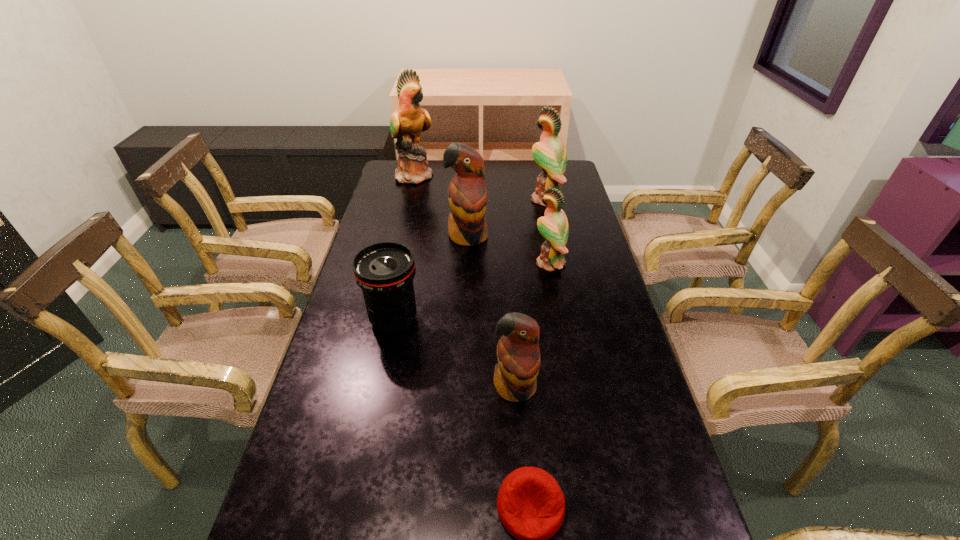
Locate an element on the screen. vacant space in between the second shortest object and the second biggest green parrot is located at coordinates (470, 260).

At what (x,y) coordinates should I click in order to perform the action: click on object that is the sixth closest one to the black telephoto lens. Please return your answer as a coordinate pair (x, y). Looking at the image, I should click on (409, 120).

Select which object appears as the fourth closest to the second farthest object. Please provide its 2D coordinates. Your answer should be formatted as a tuple, i.e. [(x, y)], where the tuple contains the x and y coordinates of a point satisfying the conditions above.

[(384, 271)]

Identify which parrot is the second nearest to the fourth farthest parrot. Please provide its 2D coordinates. Your answer should be formatted as a tuple, i.e. [(x, y)], where the tuple contains the x and y coordinates of a point satisfying the conditions above.

[(550, 154)]

Locate which parrot is the fourth closest to the second nearest object. Please provide its 2D coordinates. Your answer should be formatted as a tuple, i.e. [(x, y)], where the tuple contains the x and y coordinates of a point satisfying the conditions above.

[(409, 120)]

Choose which green parrot is the nearest neighbor to the fourth parrot from right to left. Please provide its 2D coordinates. Your answer should be formatted as a tuple, i.e. [(x, y)], where the tuple contains the x and y coordinates of a point satisfying the conditions above.

[(554, 228)]

In order to click on green parrot that stands as the closest to the beanbag in this screenshot , I will do click(554, 228).

The width and height of the screenshot is (960, 540). In order to click on free space that satisfies the following two spatial constraints: 1. on the front-facing side of the black telephoto lens; 2. on the left side of the farthest green parrot in this screenshot , I will do `click(383, 320)`.